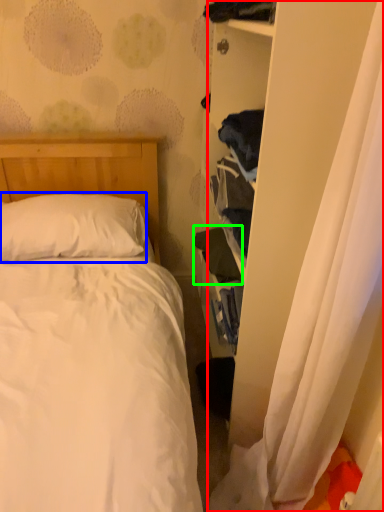
Question: Estimate the real-world distances between objects in this image. Which object is farther from curtain (highlighted by a red box), pillow (highlighted by a blue box) or clothing (highlighted by a green box)?

Choices:
 (A) pillow
 (B) clothing

Answer: (A)